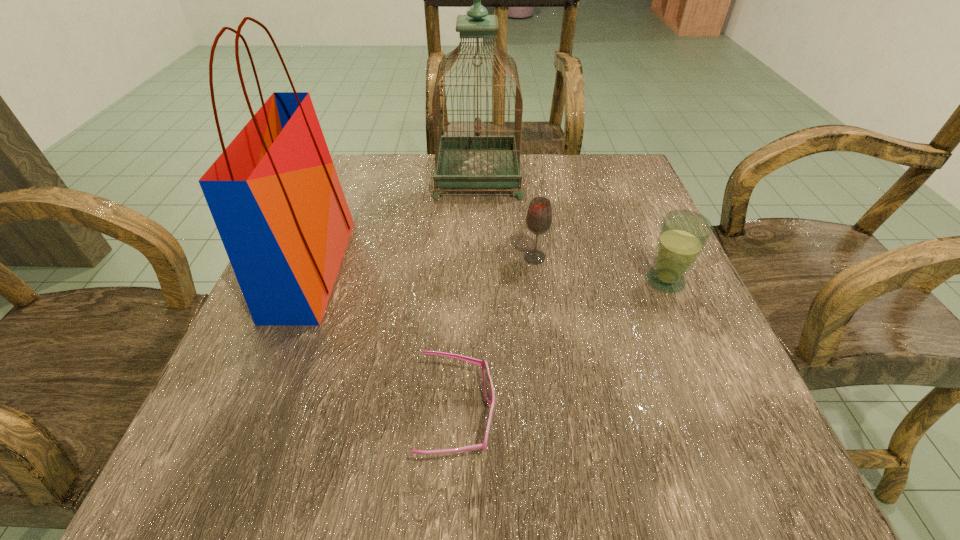
At what (x,y) coordinates should I click in order to perform the action: click on free space located on the left of the left glass drink container. Please return your answer as a coordinate pair (x, y). The width and height of the screenshot is (960, 540). Looking at the image, I should click on (314, 258).

Find the location of `free region located 0.100m on the front-facing side of the sunglasses`. free region located 0.100m on the front-facing side of the sunglasses is located at coordinates (567, 416).

At what (x,y) coordinates should I click in order to perform the action: click on object that is at the far edge. Please return your answer as a coordinate pair (x, y). This screenshot has height=540, width=960. Looking at the image, I should click on [461, 161].

Where is `object that is at the near edge`? object that is at the near edge is located at coordinates (488, 386).

In order to click on object that is positioned at the left edge in this screenshot , I will do `click(274, 194)`.

This screenshot has height=540, width=960. What are the coordinates of `object that is at the right edge` in the screenshot? It's located at (683, 235).

Find the location of a particular element. The width and height of the screenshot is (960, 540). free space at the far edge of the desktop is located at coordinates (399, 179).

Identify the location of vacant area at the near edge. (502, 500).

Locate an element on the screen. The width and height of the screenshot is (960, 540). vacant space at the left edge of the desktop is located at coordinates (240, 407).

Locate an element on the screen. free space at the far left corner is located at coordinates (360, 161).